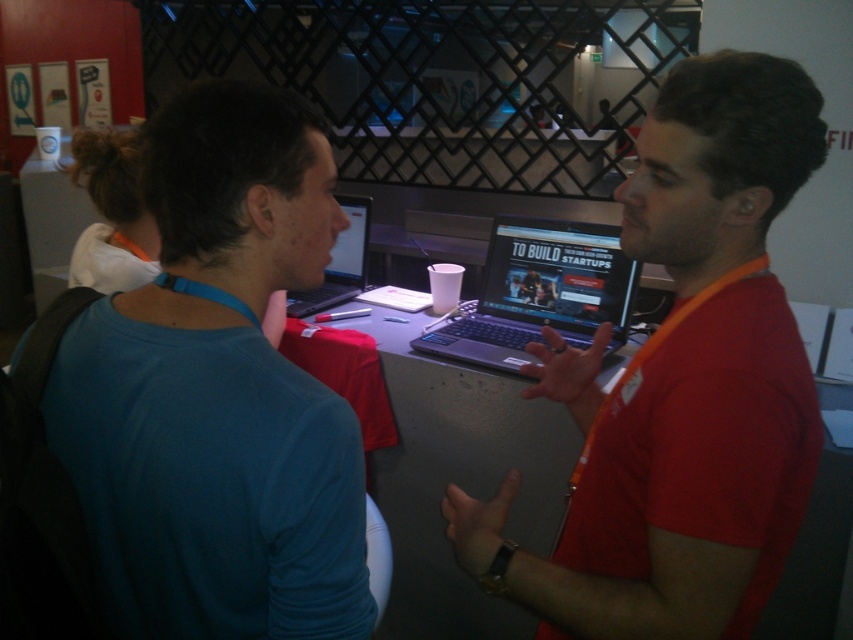
You are organizing a tech event and need to place two laptops on a table. The silver metallic laptop at center and the matte black laptop at center must be placed side by side. Given that the table has a width of 1.2 meters, will both laptops fit if placed side by side?

The silver metallic laptop at center is wider than the matte black laptop at center. However, without knowing their exact widths, it is impossible to determine if both will fit on the 1.2 meters table. More information is needed about their individual dimensions.

You are a photographer trying to capture the laptop screen showing the text TO BUILD STARTUPS in the center of the image. The camera is positioned at the same level as the laptop. There is a point marked at coordinates (538, 292) on the image. Can you confirm if this point corresponds to the silver metallic laptop at center?

Yes, the point at coordinates (538, 292) marks the silver metallic laptop at center, which is displaying the webpage with the text TO BUILD STARTUPS.

You are organizing a tech event and need to ensure that both laptops are visible to the audience. The silver metallic laptop at center and the matte black laptop at center are placed on a table. Which laptop should you adjust to make sure both are visible?

The silver metallic laptop at center is positioned under the matte black laptop at center, so you should adjust the matte black laptop to ensure both are visible.